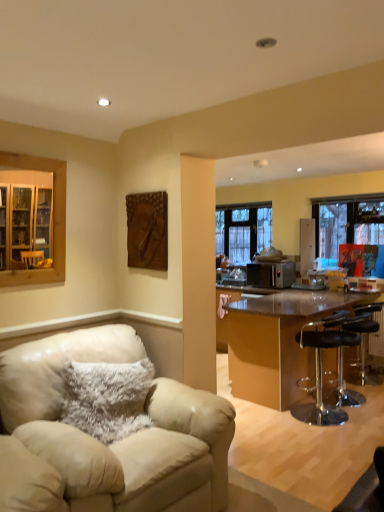
Question: Is beige leather chair at lower left, placed as the fourth chair when sorted from back to front, wider or thinner than black leather bar stool at right, positioned as the third chair in right-to-left order?

Choices:
 (A) wide
 (B) thin

Answer: (A)

Question: From the image's perspective, is beige leather chair at lower left, which ranks as the fourth chair in right-to-left order, above or below black leather bar stool at right, the 3th chair from the back?

Choices:
 (A) above
 (B) below

Answer: (B)

Question: Based on their relative distances, which object is nearer to the shiny brown table at right?

Choices:
 (A) wooden carving at upper center
 (B) black leather bar stool at right, the second chair in the left-to-right sequence
 (C) wooden cabinet at left
 (D) satin silver toaster at center
 (E) transparent glass window at right, which is the 1th window from right to left

Answer: (B)

Question: Which is farther from the transparent plastic bar stool at right, marked as the 3th chair in a left-to-right arrangement?

Choices:
 (A) wooden carving at upper center
 (B) satin silver toaster at center
 (C) wooden cabinet at left
 (D) clear glass window at center, the 1th window positioned from the back
 (E) transparent glass window at right, arranged as the first window when viewed from the front

Answer: (C)